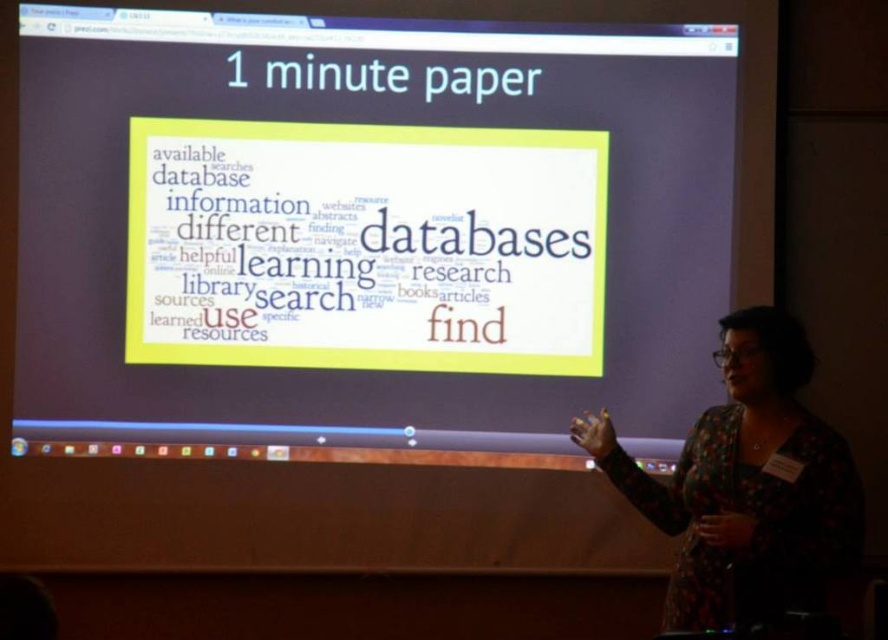
You are a student sitting in the front row of the classroom. You need to hand in a white paper at center to the presenter who is standing on the right side of the frame. The classroom has a rule that you must not walk more than 4 meters to submit any materials. Can you reach the presenter without violating the rule?

The white paper at center is 3.73 meters away from the camera, so yes, you can reach the presenter without violating the 4 meter rule since the distance is within the allowed limit.

The presenter is standing to the right of the frame. Where is the white paper at center located relative to the presenter?

The white paper at center is located to the left of the presenter since the presenter is on the right side of the frame.